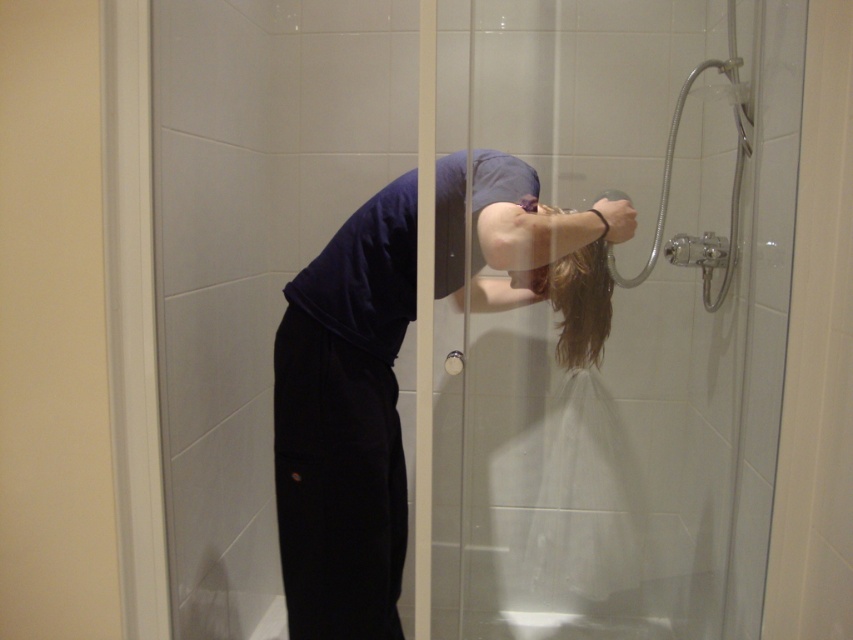
You are a designer planning to install a new showerhead in the shower. The current showerhead is at point (345,422). You want to place the new showerhead 10 cm to the right of the dark blue fabric at center. Where should you place the new showerhead?

The new showerhead should be placed 10 cm to the right of the dark blue fabric at center, which is at point (345,422).

You are in a bathroom and want to exit the shower. The transparent glass door at upper center and the clear plastic hose at upper right are in your view. Which object should you grab to open the door?

You should grab the transparent glass door at upper center to open the door since the clear plastic hose at upper right is attached to the showerhead and not the door mechanism.